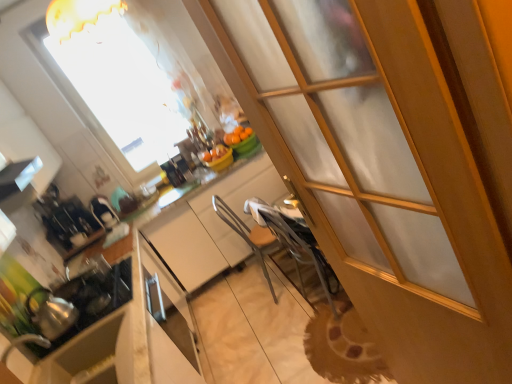
Question: Considering the relative positions of transparent glass screen door at center and orange matte bowl at center in the image provided, is transparent glass screen door at center in front of orange matte bowl at center?

Choices:
 (A) no
 (B) yes

Answer: (B)

Question: Is there a large distance between transparent glass screen door at center and orange matte bowl at center?

Choices:
 (A) yes
 (B) no

Answer: (A)

Question: Is transparent glass screen door at center outside orange matte bowl at center?

Choices:
 (A) no
 (B) yes

Answer: (B)

Question: From a real-world perspective, is transparent glass screen door at center below orange matte bowl at center?

Choices:
 (A) no
 (B) yes

Answer: (A)

Question: Does transparent glass screen door at center lie behind orange matte bowl at center?

Choices:
 (A) no
 (B) yes

Answer: (A)

Question: Is shiny silver tea pot at lower left wider or thinner than shiny metallic kettle at left, marked as the first appliance in a front-to-back arrangement?

Choices:
 (A) wide
 (B) thin

Answer: (B)

Question: Is shiny silver tea pot at lower left in front of or behind shiny metallic kettle at left, marked as the first appliance in a front-to-back arrangement, in the image?

Choices:
 (A) front
 (B) behind

Answer: (A)

Question: From a real-world perspective, is shiny silver tea pot at lower left physically located above or below shiny metallic kettle at left, placed as the 3th appliance when sorted from back to front?

Choices:
 (A) above
 (B) below

Answer: (A)

Question: From their relative heights in the image, would you say shiny silver tea pot at lower left is taller or shorter than shiny metallic kettle at left, placed as the 3th appliance when sorted from back to front?

Choices:
 (A) short
 (B) tall

Answer: (B)

Question: Is point (47, 210) positioned closer to the camera than point (96, 203)?

Choices:
 (A) closer
 (B) farther

Answer: (A)

Question: Is satin black coffee maker at left, the 2th appliance positioned from the front, taller or shorter than satin black iron at center, marked as the 1th appliance in a back-to-front arrangement?

Choices:
 (A) tall
 (B) short

Answer: (A)

Question: Considering their positions, is satin black coffee maker at left, the 2th appliance positioned from the front, located in front of or behind satin black iron at center, the 3th appliance from the front?

Choices:
 (A) behind
 (B) front

Answer: (B)

Question: Is satin black coffee maker at left, placed as the second appliance when sorted from back to front, wider or thinner than satin black iron at center, marked as the 1th appliance in a back-to-front arrangement?

Choices:
 (A) thin
 (B) wide

Answer: (B)

Question: Considering the positions of white glossy exhaust hood at upper left and satin black iron at center, the 3th appliance from the front, in the image, is white glossy exhaust hood at upper left wider or thinner than satin black iron at center, the 3th appliance from the front,?

Choices:
 (A) wide
 (B) thin

Answer: (B)

Question: From the image's perspective, is white glossy exhaust hood at upper left located above or below satin black iron at center, the 3th appliance from the front?

Choices:
 (A) above
 (B) below

Answer: (A)